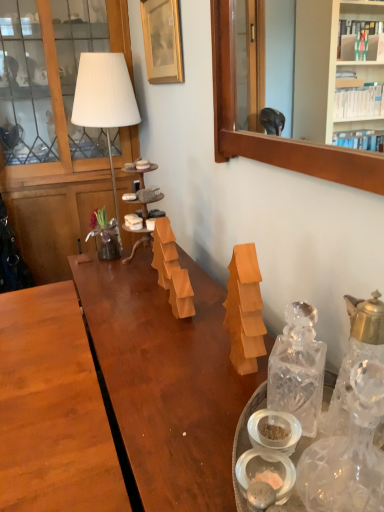
Question: Is translucent glass vase at center not near white matte spice container at center?

Choices:
 (A) yes
 (B) no

Answer: (A)

Question: From a real-world perspective, is translucent glass vase at center positioned under white matte spice container at center based on gravity?

Choices:
 (A) no
 (B) yes

Answer: (A)

Question: Is translucent glass vase at center positioned behind white matte spice container at center?

Choices:
 (A) no
 (B) yes

Answer: (B)

Question: Is translucent glass vase at center positioned with its back to white matte spice container at center?

Choices:
 (A) no
 (B) yes

Answer: (A)

Question: From a real-world perspective, is translucent glass vase at center physically above white matte spice container at center?

Choices:
 (A) no
 (B) yes

Answer: (B)

Question: Can we say translucent glass vase at center lies outside white matte spice container at center?

Choices:
 (A) no
 (B) yes

Answer: (B)

Question: Is matte wood cabinet at left positioned with its back to wooden frame at upper right?

Choices:
 (A) yes
 (B) no

Answer: (B)

Question: Considering the relative sizes of matte wood cabinet at left and wooden frame at upper right in the image provided, is matte wood cabinet at left bigger than wooden frame at upper right?

Choices:
 (A) yes
 (B) no

Answer: (A)

Question: Can you confirm if matte wood cabinet at left is positioned to the left of wooden frame at upper right?

Choices:
 (A) yes
 (B) no

Answer: (A)

Question: Does matte wood cabinet at left have a lesser width compared to wooden frame at upper right?

Choices:
 (A) yes
 (B) no

Answer: (B)

Question: Can you confirm if matte wood cabinet at left is wider than wooden frame at upper right?

Choices:
 (A) yes
 (B) no

Answer: (A)

Question: Does matte wood cabinet at left have a smaller size compared to wooden frame at upper right?

Choices:
 (A) no
 (B) yes

Answer: (A)

Question: Is clear glass carafe at right, the 2th bottle in the left-to-right sequence, at the right side of wooden picture frame at upper center?

Choices:
 (A) yes
 (B) no

Answer: (A)